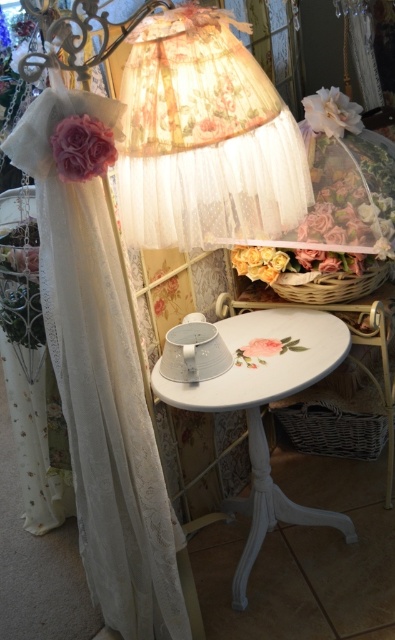
You are planning to hang a new curtain that is the same height as the white painted wood table at center. Based on the current setup, will the new curtain be taller or shorter than the existing white lace curtain at left?

The white lace curtain at left is taller than the white painted wood table at center, so the new curtain, which is the same height as the white painted wood table at center, will be shorter than the existing white lace curtain at left.